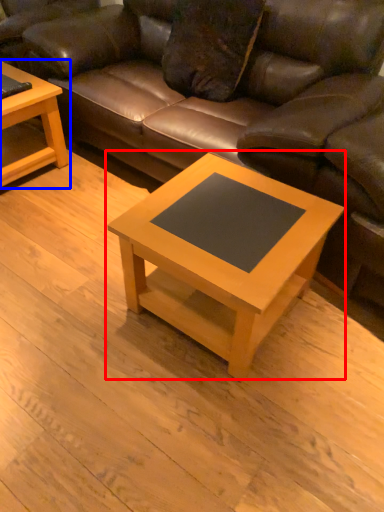
Question: Which point is further to the camera, coffee table (highlighted by a red box) or coffee table (highlighted by a blue box)?

Choices:
 (A) coffee table
 (B) coffee table

Answer: (B)